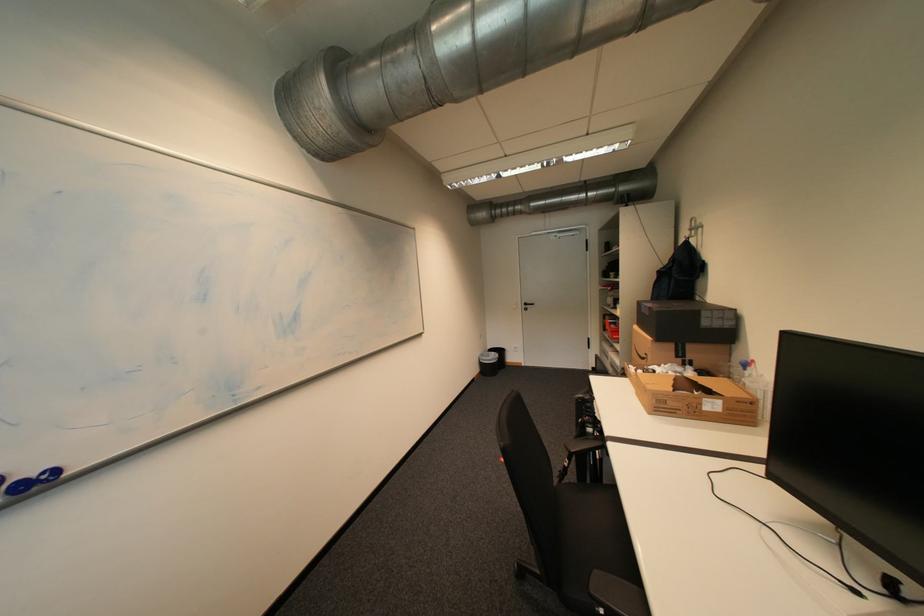
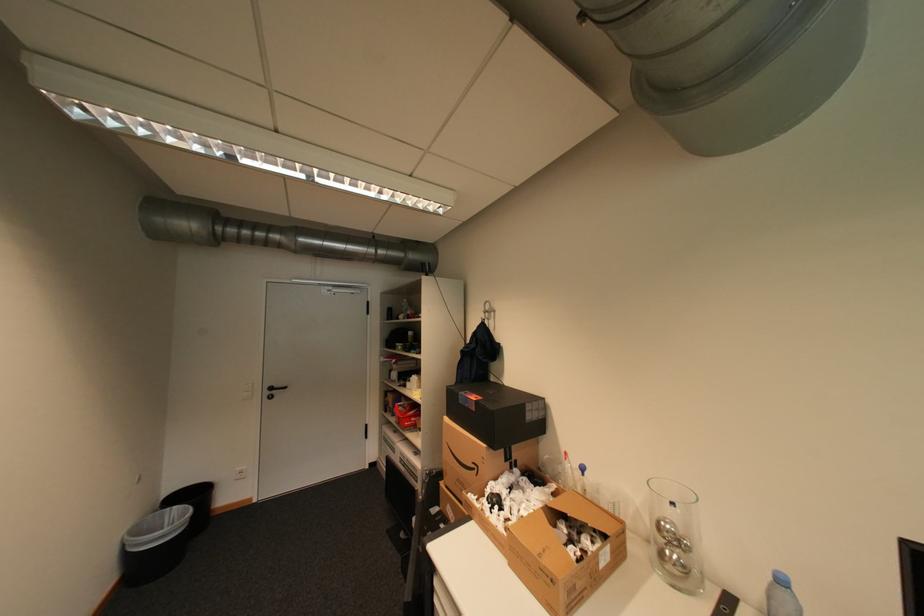
Where in the second image is the point corresponding to the point at 487,355 from the first image?

(132, 531)